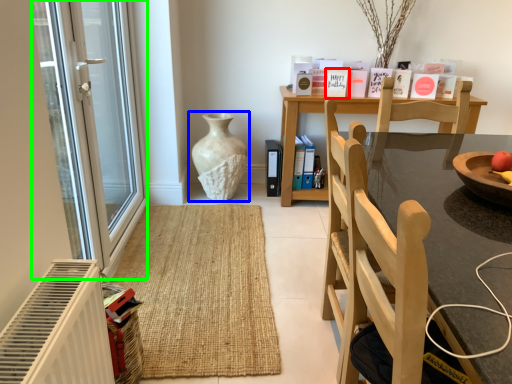
Question: Estimate the real-world distances between objects in this image. Which object is farther from book (highlighted by a red box), vase (highlighted by a blue box) or glass door (highlighted by a green box)?

Choices:
 (A) vase
 (B) glass door

Answer: (B)